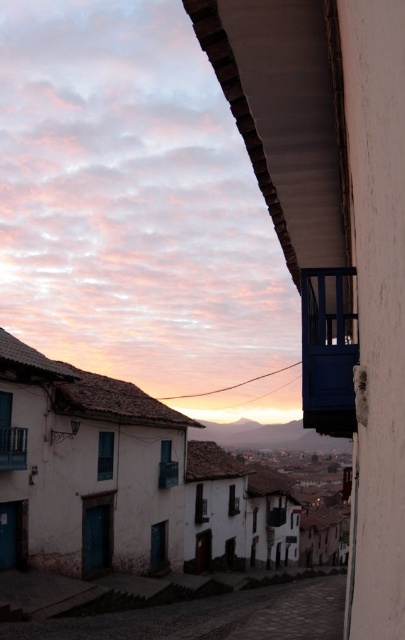
You are standing at the intersection of a narrow street with traditional white buildings. You want to take a photo of the white stucco buildings at center. Where should you position yourself to capture them in the frame?

You should position yourself at the point closest to the white stucco buildings at center, which is located at coordinates approximately 0.752 on the x axis and 0.304 on the y axis, to ensure they are centered in your photo.

You are a photographer standing on the street, and you want to capture both the white stucco buildings at center and the matte blue balcony at center in a single frame. Considering the camera you have can only focus on objects within a 20 meter distance, will you be able to include both in your photo?

The white stucco buildings at center and matte blue balcony at center are 22.11 meters apart from each other. Since the distance between them exceeds the camera focus range of 20 meters, you won